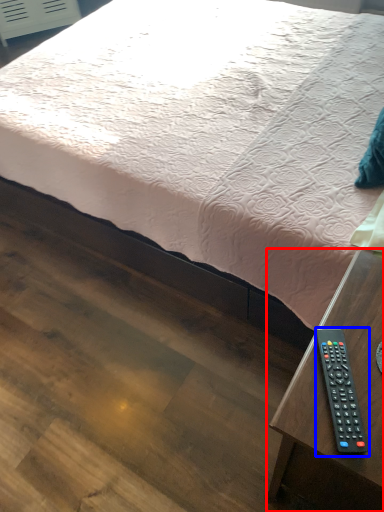
Question: Which object appears closest to the camera in this image, table (highlighted by a red box) or remote control (highlighted by a blue box)?

Choices:
 (A) table
 (B) remote control

Answer: (A)